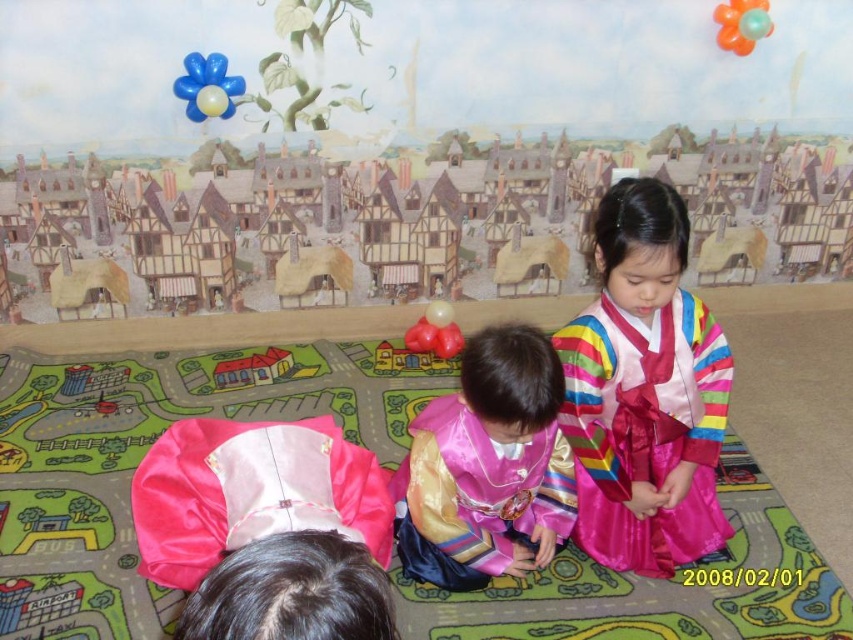
Question: Is pink satin kimono at lower left further to the viewer compared to matte plastic house at center?

Choices:
 (A) yes
 (B) no

Answer: (B)

Question: Which of the following is the farthest from the observer?

Choices:
 (A) click(437, 321)
 (B) click(212, 54)
 (C) click(415, 435)
 (D) click(155, 573)

Answer: (A)

Question: Which of the following is the closest to the observer?

Choices:
 (A) (236, 385)
 (B) (753, 13)
 (C) (148, 522)

Answer: (C)

Question: Is blue glossy balloon at upper left positioned before matte plastic house at center?

Choices:
 (A) yes
 (B) no

Answer: (A)

Question: Is pink satin kimono at lower left below matte plastic house at center?

Choices:
 (A) no
 (B) yes

Answer: (B)

Question: Which of the following is the closest to the observer?

Choices:
 (A) silky pink hanbok at center
 (B) pink satin kimono at lower left

Answer: (B)